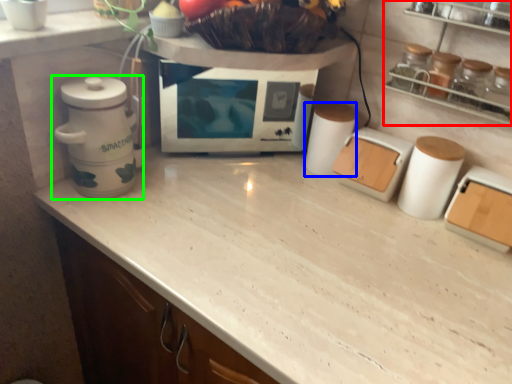
Question: Considering the real-world distances, which object is closest to shelf (highlighted by a red box)? appliance (highlighted by a blue box) or home appliance (highlighted by a green box).

Choices:
 (A) appliance
 (B) home appliance

Answer: (A)